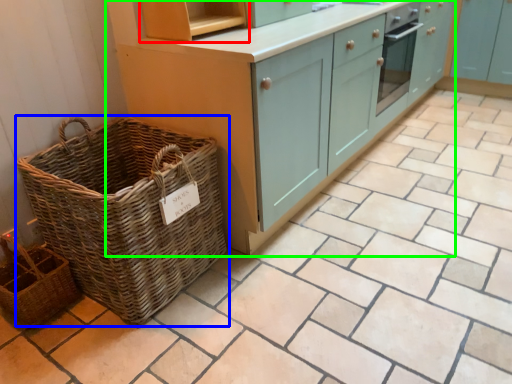
Question: Based on their relative distances, which object is nearer to shelf (highlighted by a red box)? Choose from picnic basket (highlighted by a blue box) and cabinetry (highlighted by a green box).

Choices:
 (A) picnic basket
 (B) cabinetry

Answer: (B)